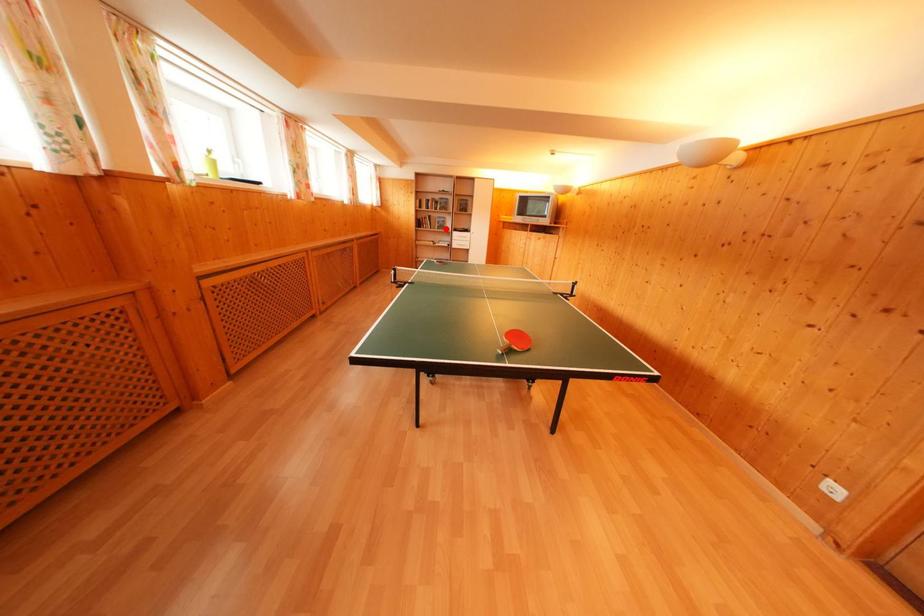
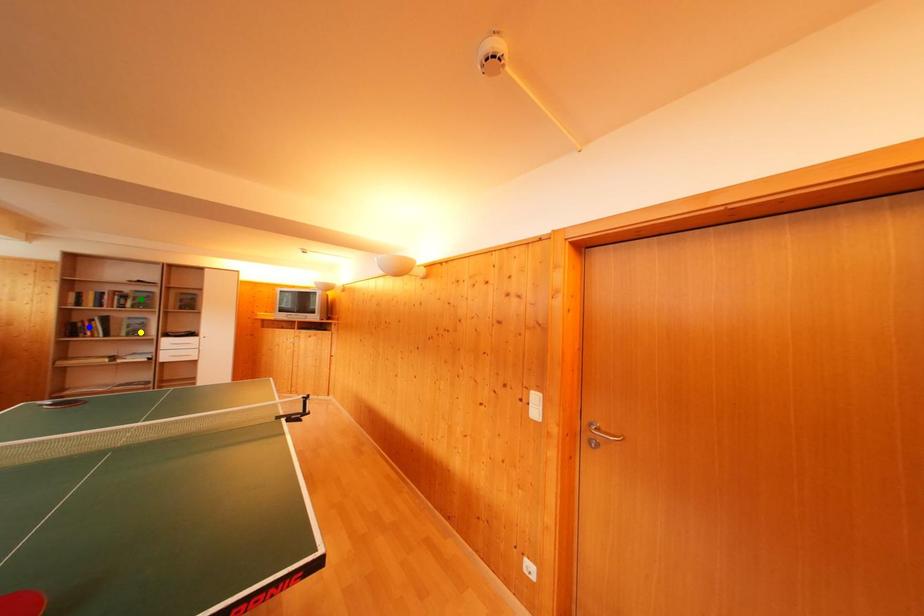
Question: I am providing you with two images of the same scene from different viewpoints. A red point is marked on the first image. You are given multiple points on the second image. Which mark in image 2 goes with the point in image 1?

Choices:
 (A) green point
 (B) blue point
 (C) yellow point

Answer: (C)